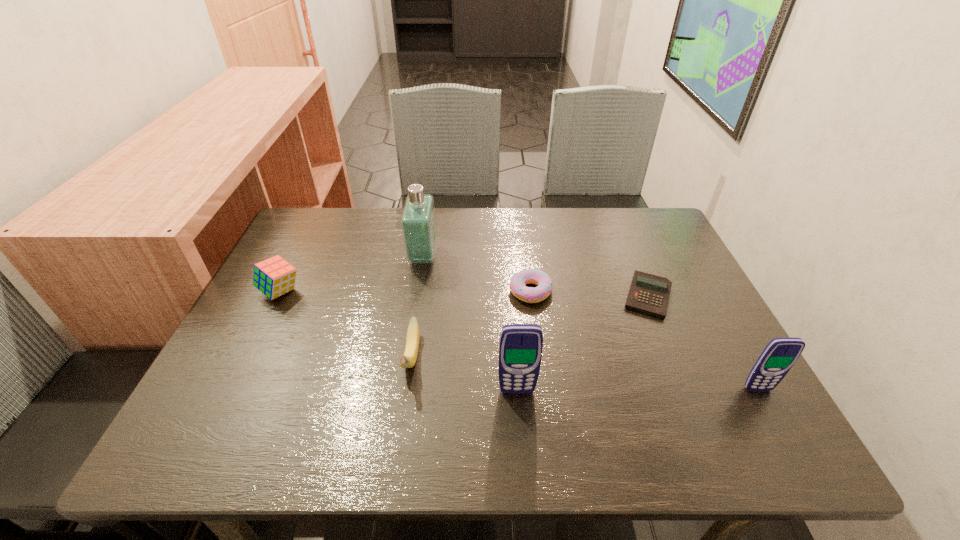
Locate an element on the screen. This screenshot has width=960, height=540. the left cellular telephone is located at coordinates (520, 347).

At what (x,y) coordinates should I click in order to perform the action: click on the taller cellular telephone. Please return your answer as a coordinate pair (x, y). The width and height of the screenshot is (960, 540). Looking at the image, I should click on (520, 347).

This screenshot has width=960, height=540. I want to click on the shorter cellular telephone, so click(780, 354).

At what (x,y) coordinates should I click in order to perform the action: click on the rightmost object. Please return your answer as a coordinate pair (x, y). This screenshot has width=960, height=540. Looking at the image, I should click on (780, 354).

This screenshot has height=540, width=960. In order to click on the farthest object in this screenshot , I will do `click(418, 222)`.

Where is `cube`? This screenshot has height=540, width=960. cube is located at coordinates (274, 277).

Find the location of a particular element. This screenshot has width=960, height=540. the second shortest object is located at coordinates (535, 276).

Find the location of `calculator`. calculator is located at coordinates (649, 294).

This screenshot has width=960, height=540. Identify the location of the shortest object. (649, 294).

Find the location of a particular element. banana is located at coordinates (408, 360).